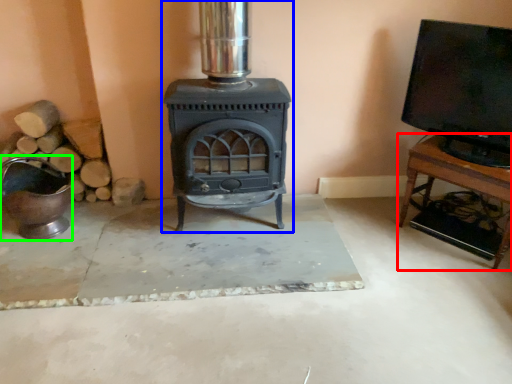
Question: Estimate the real-world distances between objects in this image. Which object is farther from furniture (highlighted by a red box), wood burning stove (highlighted by a blue box) or appliance (highlighted by a green box)?

Choices:
 (A) wood burning stove
 (B) appliance

Answer: (B)